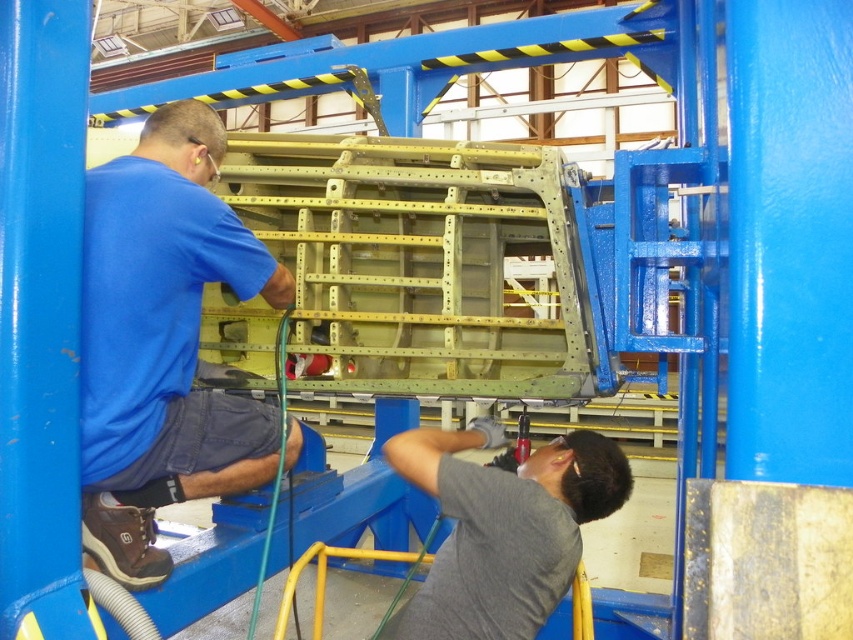
Question: Is blue fabric shirt at upper left below gray matte shirt at lower center?

Choices:
 (A) yes
 (B) no

Answer: (B)

Question: Is blue fabric shirt at upper left above gray matte shirt at lower center?

Choices:
 (A) yes
 (B) no

Answer: (A)

Question: Which point is farther to the camera?

Choices:
 (A) blue fabric shirt at upper left
 (B) gray matte shirt at lower center

Answer: (B)

Question: Does blue fabric shirt at upper left appear on the left side of gray matte shirt at lower center?

Choices:
 (A) yes
 (B) no

Answer: (A)

Question: Among these points, which one is farthest from the camera?

Choices:
 (A) [x=132, y=392]
 (B) [x=598, y=496]

Answer: (B)